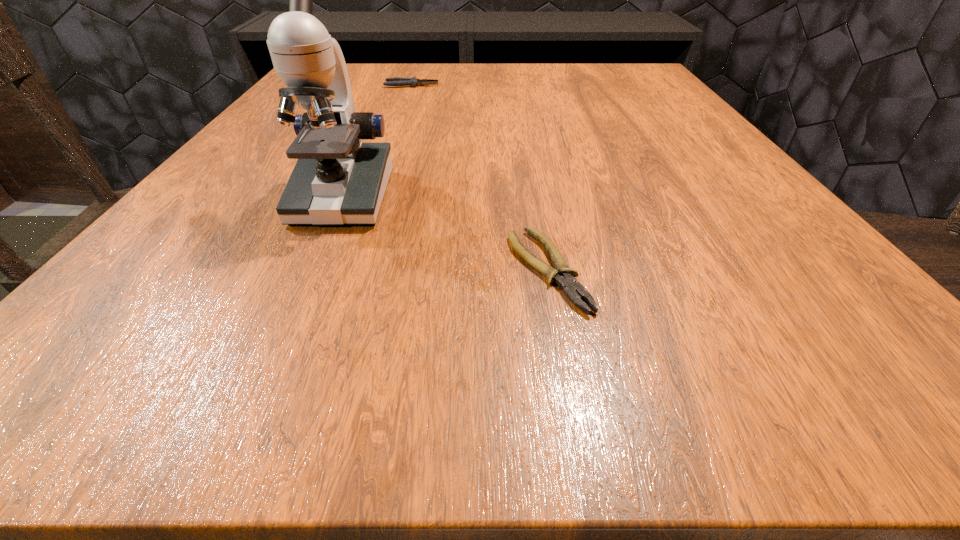
Locate an element on the screen. This screenshot has height=540, width=960. vacant space in between the microscope and the farther pliers is located at coordinates (377, 141).

Image resolution: width=960 pixels, height=540 pixels. I want to click on free space between the tallest object and the nearer pliers, so click(444, 233).

This screenshot has height=540, width=960. Identify the location of vacant region between the shorter pliers and the second nearest object. (444, 233).

Locate an element on the screen. Image resolution: width=960 pixels, height=540 pixels. free spot between the shorter pliers and the left pliers is located at coordinates (479, 177).

The image size is (960, 540). Find the location of `free space between the second nearest object and the nearer pliers`. free space between the second nearest object and the nearer pliers is located at coordinates (444, 233).

The width and height of the screenshot is (960, 540). I want to click on free space between the rightmost object and the microscope, so click(x=444, y=233).

Identify the location of free spot between the right pliers and the second shortest object. (479, 177).

Image resolution: width=960 pixels, height=540 pixels. Find the location of `object that is the second nearest to the taller pliers`. object that is the second nearest to the taller pliers is located at coordinates pyautogui.click(x=563, y=276).

Choose which object is the second nearest neighbor to the left pliers. Please provide its 2D coordinates. Your answer should be formatted as a tuple, i.e. [(x, y)], where the tuple contains the x and y coordinates of a point satisfying the conditions above.

[(563, 276)]

Locate an element on the screen. This screenshot has height=540, width=960. free spot that satisfies the following two spatial constraints: 1. at the gripping part of the left pliers; 2. on the back side of the shorter pliers is located at coordinates click(x=346, y=269).